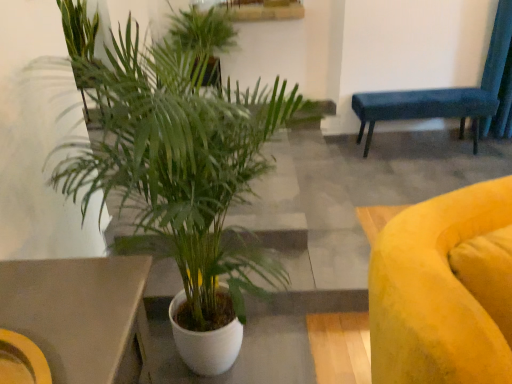
In order to face white ceramic plant at center, acting as the 2th houseplant starting from the top, should I rotate leftwards or rightwards?

You should look left and rotate roughly 8.514 degrees.

Find the location of `velvet blue bench at upper right`. velvet blue bench at upper right is located at coordinates (424, 108).

Identify the location of green leafy plant at upper center, the second houseplant positioned from the bottom. The width and height of the screenshot is (512, 384). (204, 37).

Where is `white ceramic plant at center, the second houseplant from the back`? white ceramic plant at center, the second houseplant from the back is located at coordinates (181, 166).

Considering the relative sizes of green leafy plant at upper center, arranged as the second houseplant when viewed from the front, and velvet blue bench at upper right in the image provided, is green leafy plant at upper center, arranged as the second houseplant when viewed from the front, thinner than velvet blue bench at upper right?

In fact, green leafy plant at upper center, arranged as the second houseplant when viewed from the front, might be wider than velvet blue bench at upper right.

From a real-world perspective, is green leafy plant at upper center, arranged as the second houseplant when viewed from the front, positioned over velvet blue bench at upper right based on gravity?

Yes, from a real-world perspective, green leafy plant at upper center, arranged as the second houseplant when viewed from the front, is above velvet blue bench at upper right.

Which object is further away from the camera, green leafy plant at upper center, which appears as the 1th houseplant when viewed from the back, or velvet blue bench at upper right?

velvet blue bench at upper right is further away from the camera.

Locate an element on the screen. houseplant below the green leafy plant at upper center, which is the 1th houseplant from top to bottom (from a real-world perspective) is located at coordinates (181, 166).

In the image, is green leafy plant at upper center, which appears as the 1th houseplant when viewed from the back, positioned in front of or behind white ceramic plant at center, placed as the 1th houseplant when sorted from front to back?

In the image, green leafy plant at upper center, which appears as the 1th houseplant when viewed from the back, appears behind white ceramic plant at center, placed as the 1th houseplant when sorted from front to back.

In the scene shown: From a real-world perspective, is green leafy plant at upper center, which is the 1th houseplant from top to bottom, on white ceramic plant at center, the second houseplant from the back?

Indeed, from a real-world perspective, green leafy plant at upper center, which is the 1th houseplant from top to bottom, stands above white ceramic plant at center, the second houseplant from the back.

Is velvet blue bench at upper right completely or partially outside of white ceramic plant at center, the second houseplant from the back?

That's correct, velvet blue bench at upper right is outside of white ceramic plant at center, the second houseplant from the back.

Looking at the image, does velvet blue bench at upper right seem bigger or smaller compared to white ceramic plant at center, placed as the 1th houseplant when sorted from front to back?

velvet blue bench at upper right is smaller than white ceramic plant at center, placed as the 1th houseplant when sorted from front to back.

Does velvet blue bench at upper right lie in front of white ceramic plant at center, placed as the 1th houseplant when sorted from front to back?

No.

How many degrees apart are the facing directions of velvet blue bench at upper right and white ceramic plant at center, acting as the 2th houseplant starting from the top?

There is a 89.1-degree angle between the facing directions of velvet blue bench at upper right and white ceramic plant at center, acting as the 2th houseplant starting from the top.

Between white ceramic plant at center, placed as the 1th houseplant when sorted from front to back, and green leafy plant at upper center, arranged as the second houseplant when viewed from the front, which one appears on the right side from the viewer's perspective?

white ceramic plant at center, placed as the 1th houseplant when sorted from front to back, is more to the right.

From the image's perspective, is white ceramic plant at center, the second houseplant from the back, above or below green leafy plant at upper center, arranged as the second houseplant when viewed from the front?

From the image's perspective, white ceramic plant at center, the second houseplant from the back, appears below green leafy plant at upper center, arranged as the second houseplant when viewed from the front.

In the image, is white ceramic plant at center, the second houseplant from the back, positioned in front of or behind green leafy plant at upper center, the second houseplant positioned from the bottom?

In the image, white ceramic plant at center, the second houseplant from the back, appears in front of green leafy plant at upper center, the second houseplant positioned from the bottom.

Who is shorter, white ceramic plant at center, acting as the 2th houseplant starting from the top, or green leafy plant at upper center, arranged as the second houseplant when viewed from the front?

Standing shorter between the two is green leafy plant at upper center, arranged as the second houseplant when viewed from the front.

Considering the sizes of objects velvet blue bench at upper right and green leafy plant at upper center, the second houseplant positioned from the bottom, in the image provided, who is taller, velvet blue bench at upper right or green leafy plant at upper center, the second houseplant positioned from the bottom,?

Standing taller between the two is green leafy plant at upper center, the second houseplant positioned from the bottom.

Is velvet blue bench at upper right in front of green leafy plant at upper center, arranged as the second houseplant when viewed from the front?

No, velvet blue bench at upper right is further to the viewer.

Is velvet blue bench at upper right not near green leafy plant at upper center, the second houseplant positioned from the bottom?

Indeed, velvet blue bench at upper right is not near green leafy plant at upper center, the second houseplant positioned from the bottom.

Between point (419, 115) and point (207, 18), which one is positioned behind?

Positioned behind is point (419, 115).

Based on their sizes in the image, would you say white ceramic plant at center, the second houseplant from the back, is bigger or smaller than velvet blue bench at upper right?

In the image, white ceramic plant at center, the second houseplant from the back, appears to be larger than velvet blue bench at upper right.

In the scene shown: Is white ceramic plant at center, placed as the 1th houseplant when sorted from front to back, at the left side of velvet blue bench at upper right?

Yes, white ceramic plant at center, placed as the 1th houseplant when sorted from front to back, is to the left of velvet blue bench at upper right.

Is white ceramic plant at center, placed as the 1th houseplant when sorted from front to back, wider than velvet blue bench at upper right?

Yes.

From the image's perspective, is white ceramic plant at center, the second houseplant from the back, located beneath velvet blue bench at upper right?

Yes, from the image's perspective, white ceramic plant at center, the second houseplant from the back, is below velvet blue bench at upper right.

Image resolution: width=512 pixels, height=384 pixels. I want to click on the 1st houseplant in front of the velvet blue bench at upper right, so click(x=204, y=37).

Find the location of a particular element. This screenshot has height=384, width=512. houseplant above the white ceramic plant at center, acting as the 2th houseplant starting from the top (from the image's perspective) is located at coordinates (204, 37).

Considering their positions, is green leafy plant at upper center, which appears as the 1th houseplant when viewed from the back, positioned closer to velvet blue bench at upper right than white ceramic plant at center, placed as the 1th houseplant when sorted from front to back?

green leafy plant at upper center, which appears as the 1th houseplant when viewed from the back, is positioned closer to the anchor velvet blue bench at upper right.

Looking at this image, considering their positions, is green leafy plant at upper center, which appears as the 1th houseplant when viewed from the back, positioned further to white ceramic plant at center, acting as the 2th houseplant starting from the top, than velvet blue bench at upper right?

velvet blue bench at upper right is positioned further to the anchor white ceramic plant at center, acting as the 2th houseplant starting from the top.

Looking at the image, which one is located further to green leafy plant at upper center, which is the 1th houseplant from top to bottom, white ceramic plant at center, acting as the 2th houseplant starting from the top, or velvet blue bench at upper right?

Based on the image, white ceramic plant at center, acting as the 2th houseplant starting from the top, appears to be further to green leafy plant at upper center, which is the 1th houseplant from top to bottom.

Based on their spatial positions, is velvet blue bench at upper right or green leafy plant at upper center, which is the 1th houseplant from top to bottom, further from white ceramic plant at center, placed as the 1th houseplant when sorted from front to back?

velvet blue bench at upper right is further to white ceramic plant at center, placed as the 1th houseplant when sorted from front to back.

Considering their positions, is white ceramic plant at center, placed as the 1th houseplant when sorted from front to back, positioned closer to velvet blue bench at upper right than green leafy plant at upper center, which appears as the 1th houseplant when viewed from the back?

green leafy plant at upper center, which appears as the 1th houseplant when viewed from the back, is positioned closer to the anchor velvet blue bench at upper right.

Based on their spatial positions, is velvet blue bench at upper right or white ceramic plant at center, placed as the 1th houseplant when sorted from front to back, closer to green leafy plant at upper center, which appears as the 1th houseplant when viewed from the back?

The object closer to green leafy plant at upper center, which appears as the 1th houseplant when viewed from the back, is velvet blue bench at upper right.

Identify the location of houseplant between white ceramic plant at center, acting as the 2th houseplant starting from the top, and velvet blue bench at upper right in the front-back direction. (204, 37).